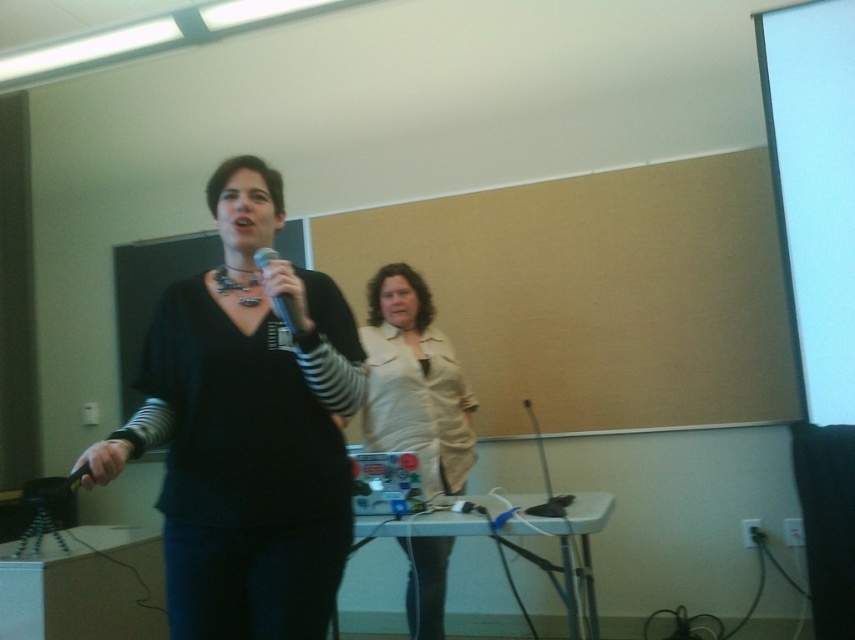
Based on the photo, is white matte projection screen at upper right taller than beige fabric coat at center?

Indeed, white matte projection screen at upper right has a greater height compared to beige fabric coat at center.

Between point (786, 273) and point (469, 412), which one is positioned behind?

The point (469, 412) is behind.

Locate an element on the screen. white matte projection screen at upper right is located at coordinates (814, 188).

In the scene shown: Can you confirm if beige fabric coat at center is positioned to the right of matte black microphone at center?

Correct, you'll find beige fabric coat at center to the right of matte black microphone at center.

Between beige fabric coat at center and matte black microphone at center, which one is positioned higher?

matte black microphone at center is higher up.

Does point (469, 428) lie behind point (255, 264)?

That is True.

This screenshot has width=855, height=640. I want to click on beige fabric coat at center, so click(414, 381).

Is white matte projection screen at upper right to the left of matte black microphone at center from the viewer's perspective?

No, white matte projection screen at upper right is not to the left of matte black microphone at center.

Is white matte projection screen at upper right in front of matte black microphone at center?

No, it is behind matte black microphone at center.

Which is in front, point (788, 154) or point (299, 326)?

Point (299, 326)

Identify the location of white matte projection screen at upper right. (814, 188).